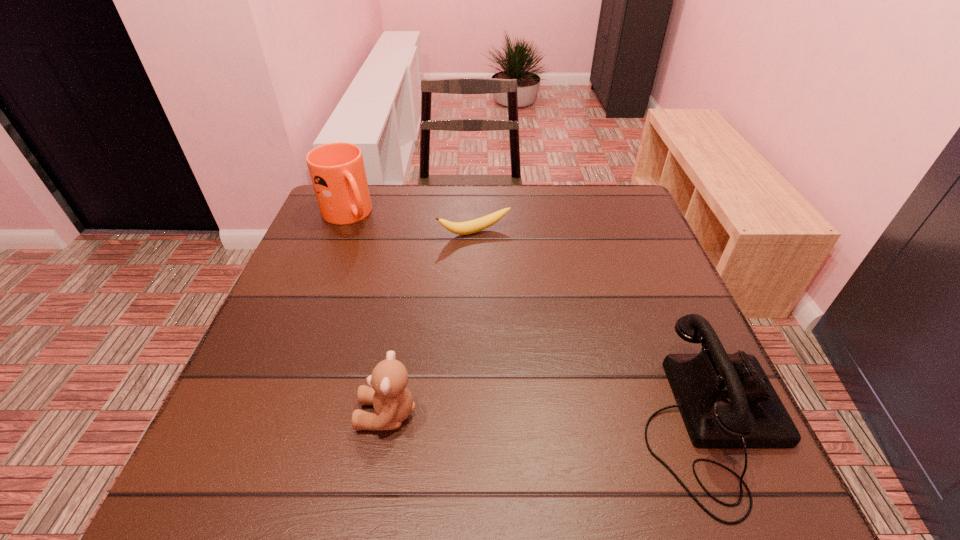
You are a GUI agent. You are given a task and a screenshot of the screen. Output one action in this format:
    pyautogui.click(x=<x>, y=<y>)
    Task: Click on the vacant point located between the teddy bear and the shortest object
    Image resolution: width=960 pixels, height=540 pixels.
    Given the screenshot: What is the action you would take?
    pyautogui.click(x=431, y=323)

I want to click on vacant area between the tallest object and the banana, so click(x=411, y=224).

Locate an element on the screen. The image size is (960, 540). free point between the third object from left to right and the third object from right to left is located at coordinates (431, 323).

The width and height of the screenshot is (960, 540). In order to click on empty space that is in between the leftmost object and the telephone in this screenshot , I will do `click(529, 319)`.

Image resolution: width=960 pixels, height=540 pixels. I want to click on vacant region between the mug and the second object from left to right, so click(x=368, y=315).

This screenshot has height=540, width=960. I want to click on empty location between the teddy bear and the leftmost object, so click(368, 315).

Where is `free space between the telephone and the tallest object`? This screenshot has height=540, width=960. free space between the telephone and the tallest object is located at coordinates (529, 319).

This screenshot has width=960, height=540. I want to click on free point between the third object from left to right and the teddy bear, so click(431, 323).

Identify the location of object that is the third nearest to the mug. (726, 400).

The width and height of the screenshot is (960, 540). Find the location of `object that is the third closest to the mug`. object that is the third closest to the mug is located at coordinates (726, 400).